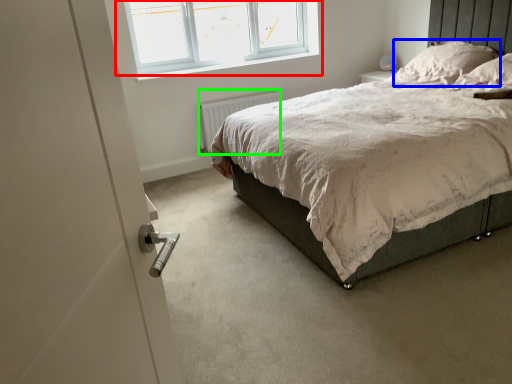
Question: Considering the real-world distances, which object is farthest from window (highlighted by a red box)? pillow (highlighted by a blue box) or radiator (highlighted by a green box)?

Choices:
 (A) pillow
 (B) radiator

Answer: (A)